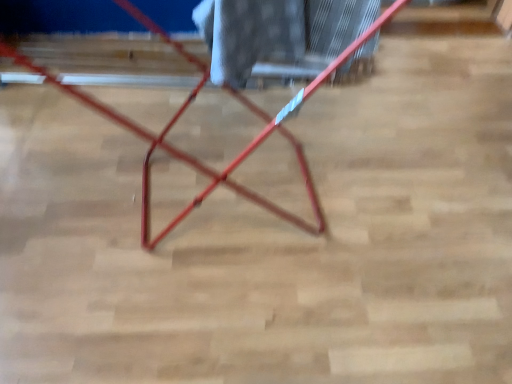
Question: Choose the correct answer: Is white textured fabric at center inside metallic red ladder at center or outside it?

Choices:
 (A) inside
 (B) outside

Answer: (A)

Question: Would you say white textured fabric at center is to the left or to the right of metallic red ladder at center in the picture?

Choices:
 (A) left
 (B) right

Answer: (B)

Question: From a real-world perspective, relative to metallic red ladder at center, is white textured fabric at center vertically above or below?

Choices:
 (A) above
 (B) below

Answer: (A)

Question: Would you say metallic red ladder at center is to the left or to the right of white textured fabric at center in the picture?

Choices:
 (A) right
 (B) left

Answer: (B)

Question: Do you think metallic red ladder at center is within white textured fabric at center, or outside of it?

Choices:
 (A) outside
 (B) inside

Answer: (A)

Question: In terms of size, does metallic red ladder at center appear bigger or smaller than white textured fabric at center?

Choices:
 (A) big
 (B) small

Answer: (A)

Question: Relative to white textured fabric at center, is metallic red ladder at center in front or behind?

Choices:
 (A) front
 (B) behind

Answer: (A)